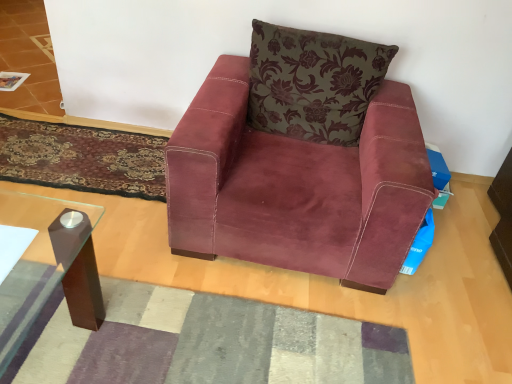
Image resolution: width=512 pixels, height=384 pixels. What do you see at coordinates (301, 160) in the screenshot?
I see `suede-like burgundy armchair at center` at bounding box center [301, 160].

The image size is (512, 384). Find the location of `suede-like burgundy armchair at center`. suede-like burgundy armchair at center is located at coordinates (301, 160).

At what (x,y) coordinates should I click in order to perform the action: click on velvet floral pillow at center. Please return your answer as a coordinate pair (x, y). The width and height of the screenshot is (512, 384). Looking at the image, I should click on (312, 83).

Who is shorter, velvet-like burgundy mat at lower left, which appears as the second mat when viewed from the front, or suede-like burgundy armchair at center?

With less height is velvet-like burgundy mat at lower left, which appears as the second mat when viewed from the front.

Can you confirm if velvet-like burgundy mat at lower left, which ranks as the second mat in bottom-to-top order, is positioned to the left of suede-like burgundy armchair at center?

Correct, you'll find velvet-like burgundy mat at lower left, which ranks as the second mat in bottom-to-top order, to the left of suede-like burgundy armchair at center.

Considering the relative sizes of velvet-like burgundy mat at lower left, the 1th mat in the back-to-front sequence, and suede-like burgundy armchair at center in the image provided, is velvet-like burgundy mat at lower left, the 1th mat in the back-to-front sequence, thinner than suede-like burgundy armchair at center?

Indeed, velvet-like burgundy mat at lower left, the 1th mat in the back-to-front sequence, has a lesser width compared to suede-like burgundy armchair at center.

Identify the location of chair located above the velvet-like burgundy mat at lower left, the 1th mat in the back-to-front sequence (from a real-world perspective). coord(301,160).

Which point is more forward, (69, 329) or (105, 161)?

Point (69, 329)

Based on their sizes in the image, would you say textured gray mat at center, the second mat when ordered from top to bottom, is bigger or smaller than velvet-like burgundy mat at lower left, which appears as the second mat when viewed from the front?

Considering their sizes, textured gray mat at center, the second mat when ordered from top to bottom, takes up more space than velvet-like burgundy mat at lower left, which appears as the second mat when viewed from the front.

Would you say velvet floral pillow at center is a long distance from velvet-like burgundy mat at lower left, which ranks as the second mat in bottom-to-top order?

velvet floral pillow at center is near velvet-like burgundy mat at lower left, which ranks as the second mat in bottom-to-top order, not far away.

Based on the photo, from the image's perspective, is velvet floral pillow at center located beneath velvet-like burgundy mat at lower left, which appears as the second mat when viewed from the front?

No, from the image's perspective, velvet floral pillow at center is not below velvet-like burgundy mat at lower left, which appears as the second mat when viewed from the front.

Is velvet floral pillow at center positioned with its back to velvet-like burgundy mat at lower left, the 1th mat in the back-to-front sequence?

No, velvet floral pillow at center is not facing away from velvet-like burgundy mat at lower left, the 1th mat in the back-to-front sequence.

Considering the positions of objects suede-like burgundy armchair at center and velvet-like burgundy mat at lower left, the 1th mat in the back-to-front sequence, in the image provided, who is more to the left, suede-like burgundy armchair at center or velvet-like burgundy mat at lower left, the 1th mat in the back-to-front sequence,?

velvet-like burgundy mat at lower left, the 1th mat in the back-to-front sequence.

Is velvet-like burgundy mat at lower left, placed as the 1th mat when sorted from top to bottom, at the back of suede-like burgundy armchair at center?

No, suede-like burgundy armchair at center is not facing away from velvet-like burgundy mat at lower left, placed as the 1th mat when sorted from top to bottom.

From the image's perspective, which one is positioned lower, suede-like burgundy armchair at center or velvet-like burgundy mat at lower left, which ranks as the second mat in bottom-to-top order?

velvet-like burgundy mat at lower left, which ranks as the second mat in bottom-to-top order, from the image's perspective.

The image size is (512, 384). Find the location of `mat that is in front of the suede-like burgundy armchair at center`. mat that is in front of the suede-like burgundy armchair at center is located at coordinates (212, 343).

Looking at this image, would you consider suede-like burgundy armchair at center to be distant from textured gray mat at center, the second mat when ordered from top to bottom?

No, suede-like burgundy armchair at center is in close proximity to textured gray mat at center, the second mat when ordered from top to bottom.

Does suede-like burgundy armchair at center appear on the right side of textured gray mat at center, the second mat when ordered from top to bottom?

Indeed, suede-like burgundy armchair at center is positioned on the right side of textured gray mat at center, the second mat when ordered from top to bottom.

Looking at this image, between velvet-like burgundy mat at lower left, which appears as the second mat when viewed from the front, and velvet floral pillow at center, which one has larger width?

velvet-like burgundy mat at lower left, which appears as the second mat when viewed from the front.

Between point (25, 176) and point (328, 54), which one is positioned behind?

The point (25, 176) is behind.

Does velvet-like burgundy mat at lower left, placed as the 1th mat when sorted from top to bottom, contain velvet floral pillow at center?

That's incorrect, velvet floral pillow at center is not inside velvet-like burgundy mat at lower left, placed as the 1th mat when sorted from top to bottom.

Is velvet-like burgundy mat at lower left, placed as the 1th mat when sorted from top to bottom, touching velvet floral pillow at center?

velvet-like burgundy mat at lower left, placed as the 1th mat when sorted from top to bottom, and velvet floral pillow at center are not in contact.

Consider the image. Do you think suede-like burgundy armchair at center is within velvet floral pillow at center, or outside of it?

suede-like burgundy armchair at center is not inside velvet floral pillow at center, it's outside.

Would you consider suede-like burgundy armchair at center to be distant from velvet floral pillow at center?

suede-like burgundy armchair at center is near velvet floral pillow at center, not far away.

Could you tell me if suede-like burgundy armchair at center is turned towards velvet floral pillow at center?

No.

Which point is more forward, (269, 118) or (254, 118)?

Positioned in front is point (269, 118).

Locate an element on the screen. chair in front of the velvet-like burgundy mat at lower left, the 1th mat in the back-to-front sequence is located at coordinates (301, 160).

Where is `mat on the left of textured gray mat at center, the second mat when ordered from top to bottom`? Image resolution: width=512 pixels, height=384 pixels. mat on the left of textured gray mat at center, the second mat when ordered from top to bottom is located at coordinates (82, 158).

Considering their positions, is velvet-like burgundy mat at lower left, the 1th mat in the back-to-front sequence, positioned further to velvet floral pillow at center than suede-like burgundy armchair at center?

The object further to velvet floral pillow at center is velvet-like burgundy mat at lower left, the 1th mat in the back-to-front sequence.

Looking at the image, which one is located further to suede-like burgundy armchair at center, velvet-like burgundy mat at lower left, placed as the 1th mat when sorted from top to bottom, or textured gray mat at center, acting as the 2th mat starting from the back?

velvet-like burgundy mat at lower left, placed as the 1th mat when sorted from top to bottom, is further to suede-like burgundy armchair at center.

When comparing their distances from velvet-like burgundy mat at lower left, placed as the 1th mat when sorted from top to bottom, does textured gray mat at center, acting as the 2th mat starting from the back, or velvet floral pillow at center seem further?

The object further to velvet-like burgundy mat at lower left, placed as the 1th mat when sorted from top to bottom, is velvet floral pillow at center.

From the image, which object appears to be nearer to velvet floral pillow at center, velvet-like burgundy mat at lower left, placed as the 1th mat when sorted from top to bottom, or textured gray mat at center, the second mat when ordered from top to bottom?

velvet-like burgundy mat at lower left, placed as the 1th mat when sorted from top to bottom.

Based on their spatial positions, is suede-like burgundy armchair at center or textured gray mat at center, the first mat ordered from the bottom, further from velvet floral pillow at center?

textured gray mat at center, the first mat ordered from the bottom, is positioned further to the anchor velvet floral pillow at center.

Which object lies nearer to the anchor point textured gray mat at center, the second mat when ordered from top to bottom, velvet-like burgundy mat at lower left, placed as the 1th mat when sorted from top to bottom, or velvet floral pillow at center?

Among the two, velvet-like burgundy mat at lower left, placed as the 1th mat when sorted from top to bottom, is located nearer to textured gray mat at center, the second mat when ordered from top to bottom.

Based on their spatial positions, is velvet floral pillow at center or suede-like burgundy armchair at center further from textured gray mat at center, which appears as the 1th mat when viewed from the front?

Among the two, velvet floral pillow at center is located further to textured gray mat at center, which appears as the 1th mat when viewed from the front.

Considering their positions, is textured gray mat at center, the second mat when ordered from top to bottom, positioned closer to velvet-like burgundy mat at lower left, which ranks as the second mat in bottom-to-top order, than suede-like burgundy armchair at center?

suede-like burgundy armchair at center is closer to velvet-like burgundy mat at lower left, which ranks as the second mat in bottom-to-top order.

The width and height of the screenshot is (512, 384). In order to click on chair that lies between velvet floral pillow at center and textured gray mat at center, the second mat when ordered from top to bottom, from top to bottom in this screenshot , I will do `click(301, 160)`.

The width and height of the screenshot is (512, 384). In order to click on mat located between velvet-like burgundy mat at lower left, which appears as the second mat when viewed from the front, and suede-like burgundy armchair at center in the left-right direction in this screenshot , I will do `click(212, 343)`.

Where is `chair between velvet-like burgundy mat at lower left, which appears as the second mat when viewed from the front, and velvet floral pillow at center`? chair between velvet-like burgundy mat at lower left, which appears as the second mat when viewed from the front, and velvet floral pillow at center is located at coordinates (301, 160).

You are a GUI agent. You are given a task and a screenshot of the screen. Output one action in this format:
    pyautogui.click(x=<x>, y=<y>)
    Task: Click on the mat between velvet-like burgundy mat at lower left, placed as the 1th mat when sorted from top to bottom, and velvet floral pillow at center
    The height and width of the screenshot is (384, 512).
    Given the screenshot: What is the action you would take?
    pyautogui.click(x=212, y=343)